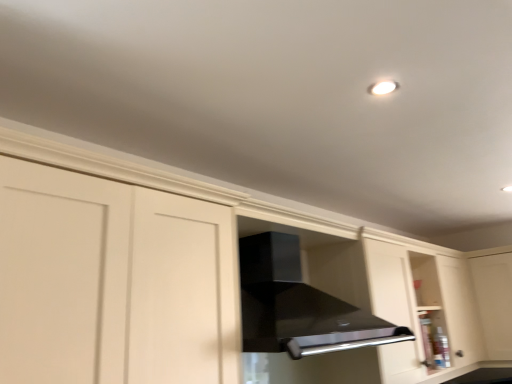
Question: Is black glossy vent at center taller than transparent glass cabinet at right?

Choices:
 (A) no
 (B) yes

Answer: (A)

Question: Is black glossy vent at center placed right next to transparent glass cabinet at right?

Choices:
 (A) no
 (B) yes

Answer: (A)

Question: From the image's perspective, is black glossy vent at center below transparent glass cabinet at right?

Choices:
 (A) no
 (B) yes

Answer: (A)

Question: From a real-world perspective, does black glossy vent at center stand above transparent glass cabinet at right?

Choices:
 (A) yes
 (B) no

Answer: (A)

Question: Is black glossy vent at center at the left side of transparent glass cabinet at right?

Choices:
 (A) yes
 (B) no

Answer: (A)

Question: From a real-world perspective, is black glossy vent at center positioned under transparent glass cabinet at right based on gravity?

Choices:
 (A) no
 (B) yes

Answer: (A)

Question: Is transparent glass cabinet at right shorter than black glossy vent at center?

Choices:
 (A) yes
 (B) no

Answer: (B)

Question: Can we say transparent glass cabinet at right lies outside black glossy vent at center?

Choices:
 (A) yes
 (B) no

Answer: (A)

Question: From the image's perspective, is transparent glass cabinet at right located above black glossy vent at center?

Choices:
 (A) yes
 (B) no

Answer: (B)

Question: Does transparent glass cabinet at right turn towards black glossy vent at center?

Choices:
 (A) yes
 (B) no

Answer: (A)

Question: Is transparent glass cabinet at right smaller than black glossy vent at center?

Choices:
 (A) no
 (B) yes

Answer: (B)

Question: Is transparent glass cabinet at right bigger than black glossy vent at center?

Choices:
 (A) no
 (B) yes

Answer: (A)

Question: In terms of height, does black glossy vent at center look taller or shorter compared to transparent glass cabinet at right?

Choices:
 (A) short
 (B) tall

Answer: (A)